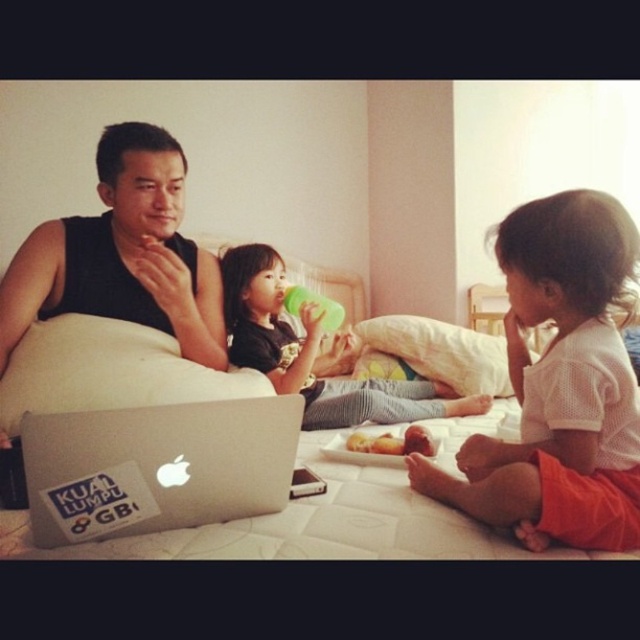
Is silver metallic laptop at lower left closer to camera compared to black matte tank top at center?

Yes, silver metallic laptop at lower left is closer to the viewer.

Between silver metallic laptop at lower left and black matte tank top at center, which one is positioned lower?

Positioned lower is silver metallic laptop at lower left.

Locate an element on the screen. silver metallic laptop at lower left is located at coordinates (156, 467).

Image resolution: width=640 pixels, height=640 pixels. Find the location of `silver metallic laptop at lower left`. silver metallic laptop at lower left is located at coordinates (156, 467).

Is silver metallic laptop at lower left positioned in front of matte black shirt at center?

That is True.

Is silver metallic laptop at lower left thinner than matte black shirt at center?

Yes.

Who is more distant from viewer, (x=125, y=467) or (x=278, y=324)?

Positioned behind is point (x=278, y=324).

Identify the location of silver metallic laptop at lower left. (156, 467).

Is black matte tank top at center thinner than matte black shirt at center?

Indeed, black matte tank top at center has a lesser width compared to matte black shirt at center.

Is point (198, 291) positioned after point (369, 410)?

No, it is in front of (369, 410).

Find the location of a particular element. black matte tank top at center is located at coordinates (122, 253).